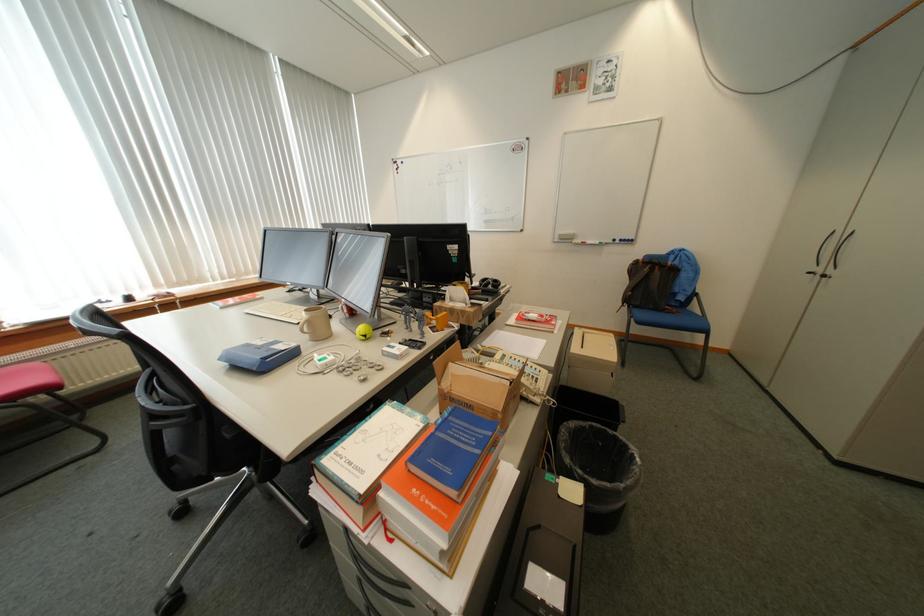
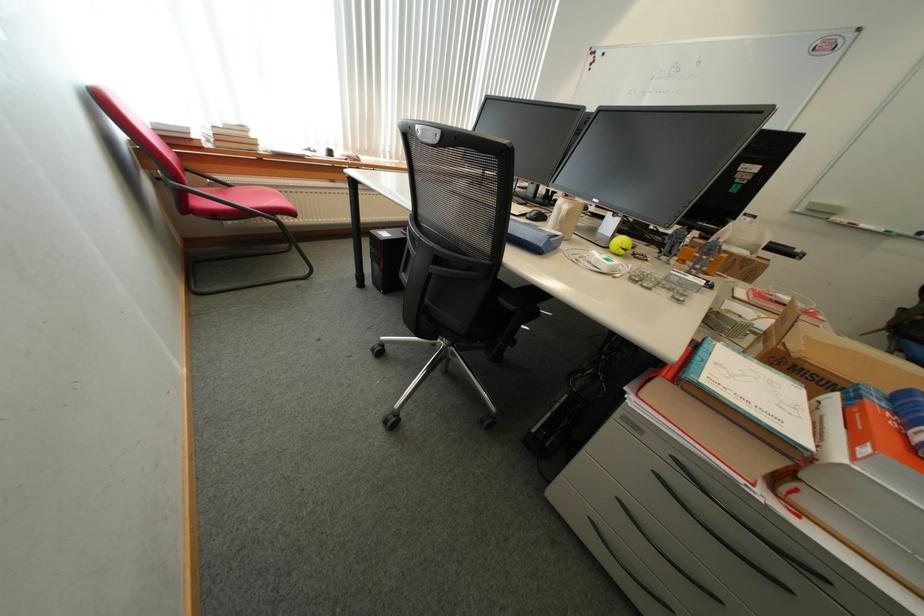
Question: Which direction would the cameraman need to move to produce the second image? Reply with the corresponding letter.

Choices:
 (A) Left
 (B) Right
 (C) Forward
 (D) Backward

Answer: (A)